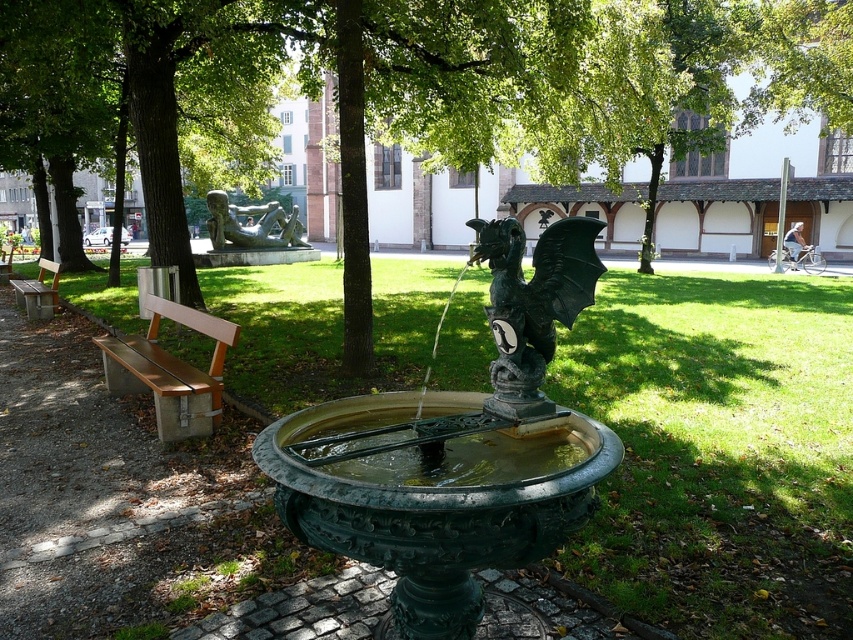
Does green leafy tree at center appear under green patinated metal dragon fountain at center?

Incorrect, green leafy tree at center is not positioned below green patinated metal dragon fountain at center.

Is point (834, 81) in front of point (468, 636)?

No.

Where is `green leafy tree at center`? green leafy tree at center is located at coordinates (572, 90).

Locate an element on the screen. This screenshot has width=853, height=640. green leafy tree at center is located at coordinates (572, 90).

Is green polished stone dragon at center closer to camera compared to brown wood bench at left?

Yes, it is.

Does green polished stone dragon at center appear over brown wood bench at left?

Indeed, green polished stone dragon at center is positioned over brown wood bench at left.

Which is behind, point (496, 317) or point (167, 362)?

Point (167, 362)

In order to click on green polished stone dragon at center in this screenshot , I will do `click(532, 304)`.

Is point (384, 0) behind point (294, 232)?

That is False.

Consider the image. Is green leafy tree at center further to the viewer compared to bronze statue at center?

No, green leafy tree at center is in front of bronze statue at center.

This screenshot has width=853, height=640. In order to click on green leafy tree at center in this screenshot , I will do `click(572, 90)`.